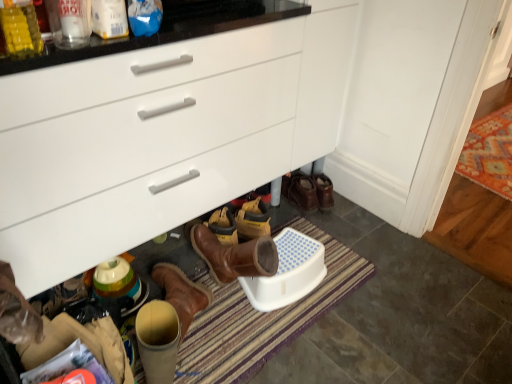
What are the coordinates of `free space in front of white plastic phone at lower center` in the screenshot? It's located at (310, 348).